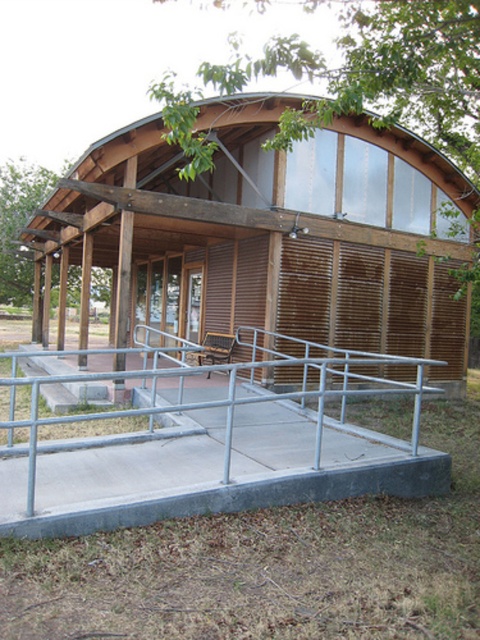
In the scene shown: Does wooden hut at center appear on the right side of silver metallic rail at center?

Incorrect, wooden hut at center is not on the right side of silver metallic rail at center.

Does wooden hut at center appear over silver metallic rail at center?

Yes, wooden hut at center is above silver metallic rail at center.

Is point (257, 116) behind point (245, 490)?

Yes, it is behind point (245, 490).

Where is `wooden hut at center`? This screenshot has width=480, height=640. wooden hut at center is located at coordinates (269, 234).